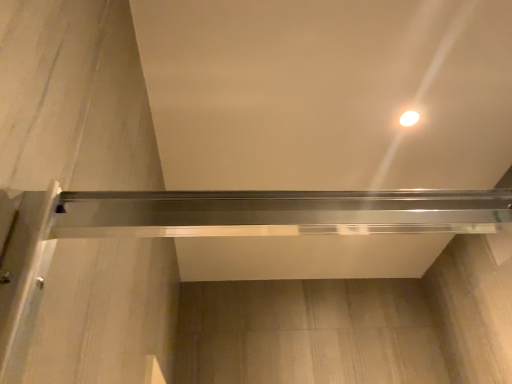
You are a GUI agent. You are given a task and a screenshot of the screen. Output one action in this format:
    pyautogui.click(x=<x>, y=<y>)
    Task: Click on the white glossy light fixture at upper center
    This screenshot has width=512, height=384.
    Given the screenshot: What is the action you would take?
    pyautogui.click(x=409, y=118)

Image resolution: width=512 pixels, height=384 pixels. Describe the element at coordinates (409, 118) in the screenshot. I see `white glossy light fixture at upper center` at that location.

What is the approximate width of white glossy light fixture at upper center?

The width of white glossy light fixture at upper center is 2.51 inches.

This screenshot has height=384, width=512. Identify the location of white glossy light fixture at upper center. (409, 118).